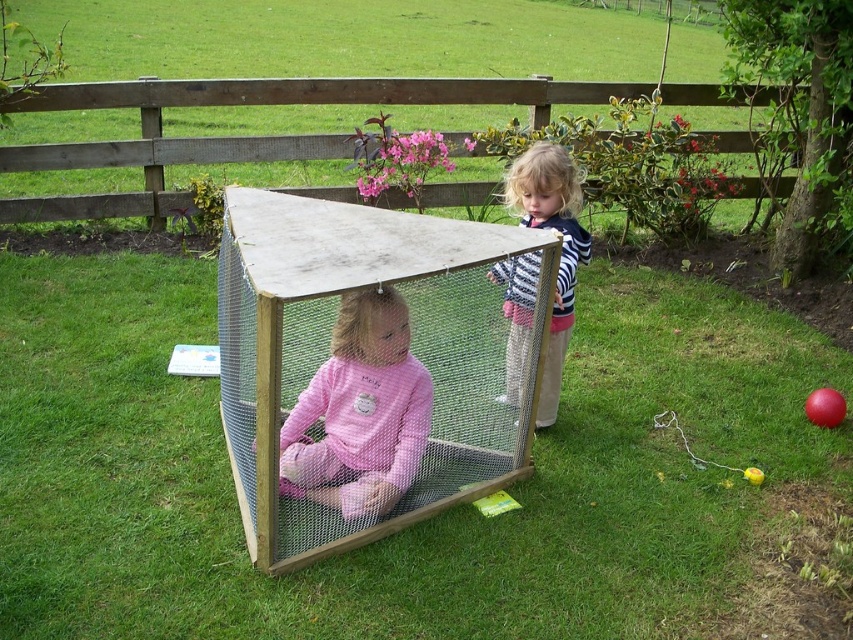
Can you confirm if metal mesh cage at center is shorter than striped knit sweater at center?

In fact, metal mesh cage at center may be taller than striped knit sweater at center.

Identify the location of metal mesh cage at center. The width and height of the screenshot is (853, 640). (360, 365).

Is point (439, 324) closer to viewer compared to point (537, 193)?

No, (439, 324) is behind (537, 193).

You are a GUI agent. You are given a task and a screenshot of the screen. Output one action in this format:
    pyautogui.click(x=<x>, y=<y>)
    Task: Click on the metal mesh cage at center
    This screenshot has width=853, height=640.
    Given the screenshot: What is the action you would take?
    pyautogui.click(x=360, y=365)

Who is positioned more to the left, pink fleece at center or striped knit sweater at center?

From the viewer's perspective, pink fleece at center appears more on the left side.

Is pink fleece at center closer to camera compared to striped knit sweater at center?

No, it is not.

This screenshot has height=640, width=853. Describe the element at coordinates (361, 412) in the screenshot. I see `pink fleece at center` at that location.

Where is `pink fleece at center`? This screenshot has width=853, height=640. pink fleece at center is located at coordinates (361, 412).

Who is positioned more to the left, striped knit sweater at center or rubber ball at lower right?

Positioned to the left is striped knit sweater at center.

Is striped knit sweater at center behind rubber ball at lower right?

No, striped knit sweater at center is closer to the viewer.

Is point (503, 262) closer to camera compared to point (822, 416)?

Yes, it is in front of point (822, 416).

In order to click on striped knit sweater at center in this screenshot , I will do `click(561, 246)`.